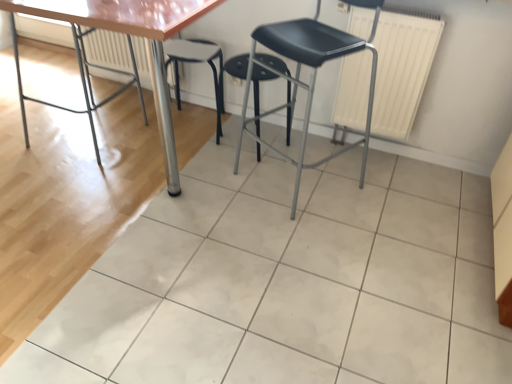
Locate an element on the screen. The height and width of the screenshot is (384, 512). blank space to the left of black plastic stool at center, acting as the second stool starting from the left is located at coordinates (200, 152).